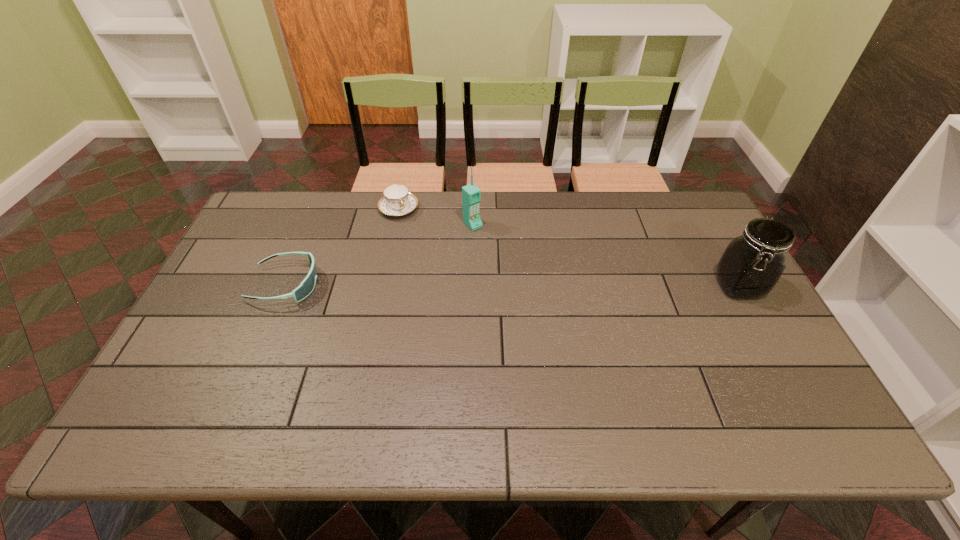
The width and height of the screenshot is (960, 540). In order to click on vacant position located 0.290m on the side with the handle of the teacup in this screenshot , I will do `click(441, 276)`.

Identify the location of free spot located on the side with the handle of the teacup. (428, 257).

You are a GUI agent. You are given a task and a screenshot of the screen. Output one action in this format:
    pyautogui.click(x=<x>, y=<y>)
    Task: Click on the cellular telephone that is at the far edge
    
    Given the screenshot: What is the action you would take?
    pyautogui.click(x=471, y=195)

At what (x,y) coordinates should I click in order to perform the action: click on teacup that is at the far edge. Please return your answer as a coordinate pair (x, y). The width and height of the screenshot is (960, 540). Looking at the image, I should click on (397, 201).

Locate an element on the screen. This screenshot has width=960, height=540. object at the left edge is located at coordinates [x=307, y=285].

What are the coordinates of `object that is positioned at the right edge` in the screenshot? It's located at [x=751, y=265].

The image size is (960, 540). I want to click on free region at the far edge of the desktop, so click(x=524, y=206).

You are a GUI agent. You are given a task and a screenshot of the screen. Output one action in this format:
    pyautogui.click(x=<x>, y=<y>)
    Task: Click on the vacant point at the near edge
    
    Given the screenshot: What is the action you would take?
    pyautogui.click(x=681, y=395)

This screenshot has height=540, width=960. I want to click on free location at the left edge of the desktop, so click(x=261, y=242).

In order to click on free space at the far left corner of the desktop in this screenshot , I will do `click(305, 198)`.